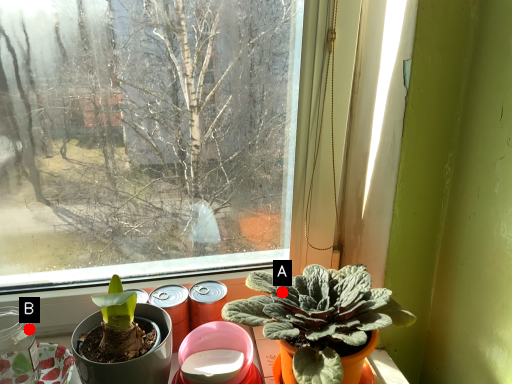
Question: Two points are circled on the image, labeled by A and B beside each circle. Which point is farther from the camera taking this photo?

Choices:
 (A) A is further
 (B) B is further

Answer: (B)